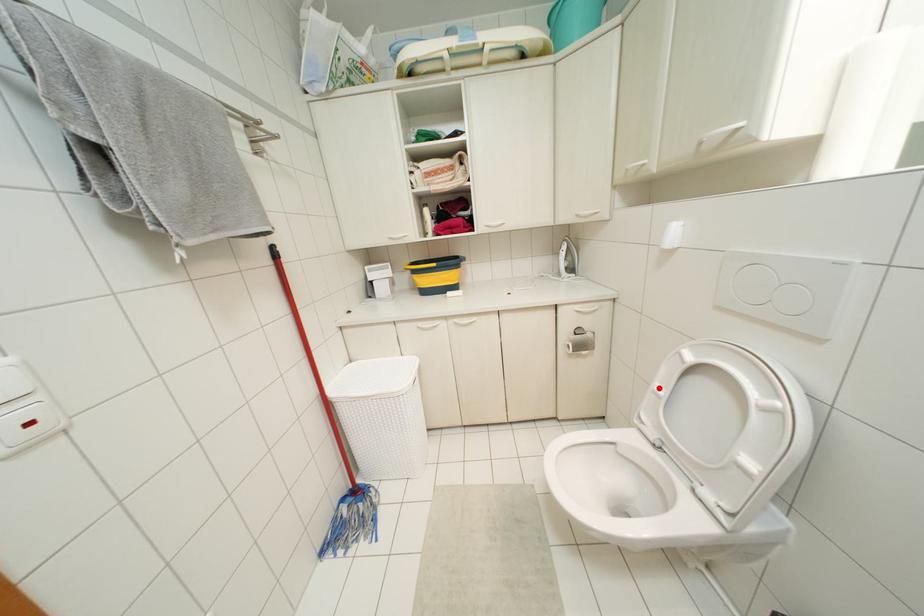
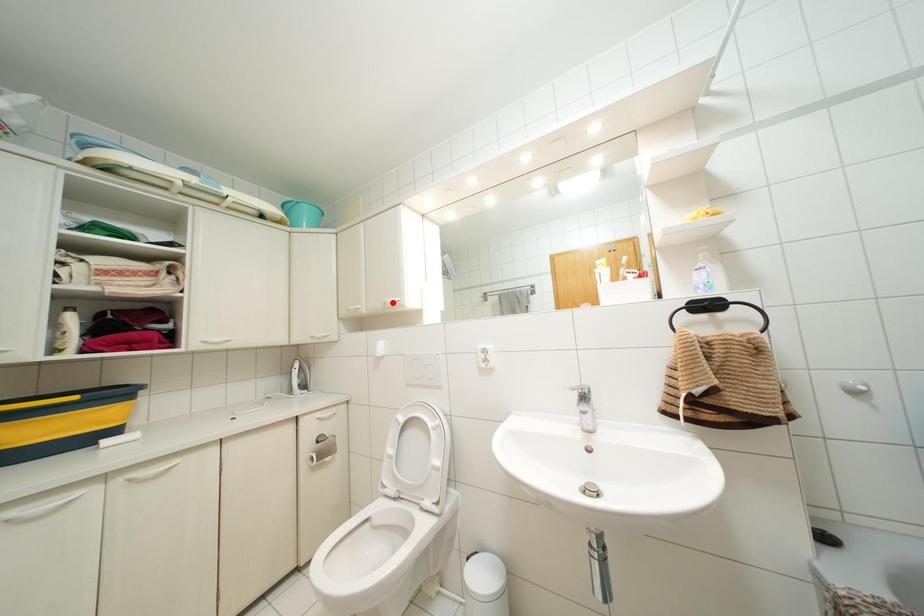
I am providing you with two images of the same scene from different viewpoints. A red point is marked on the first image and another point is marked on the second image. Are the points marked in image1 and image2 representing the same 3D position?

No